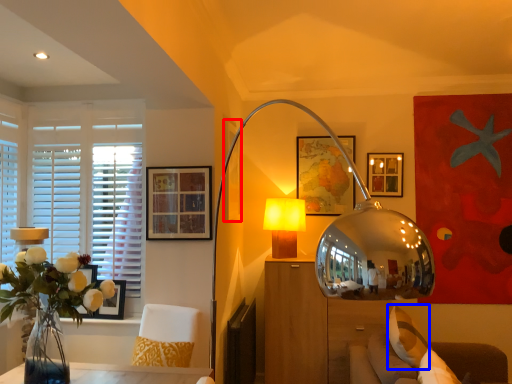
Question: Among these objects, which one is nearest to the camera, picture frame (highlighted by a red box) or pillow (highlighted by a blue box)?

Choices:
 (A) picture frame
 (B) pillow

Answer: (B)